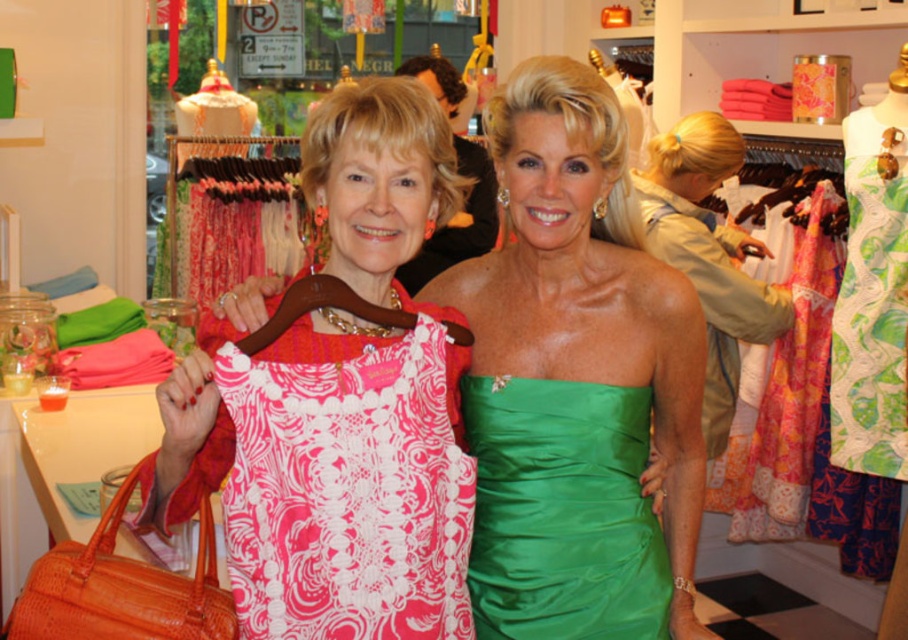
Question: Which point is closer to the camera?

Choices:
 (A) (333, 624)
 (B) (650, 540)

Answer: (A)

Question: Which object appears closest to the camera in this image?

Choices:
 (A) green satin dress at center
 (B) pink lace dress at center

Answer: (B)

Question: Is pink lace dress at center above green satin dress at center?

Choices:
 (A) no
 (B) yes

Answer: (B)

Question: Which point appears closest to the camera in this image?

Choices:
 (A) (551, 480)
 (B) (400, 481)

Answer: (B)

Question: Can you confirm if pink lace dress at center is wider than green satin dress at center?

Choices:
 (A) no
 (B) yes

Answer: (B)

Question: Can you confirm if pink lace dress at center is thinner than green satin dress at center?

Choices:
 (A) no
 (B) yes

Answer: (A)